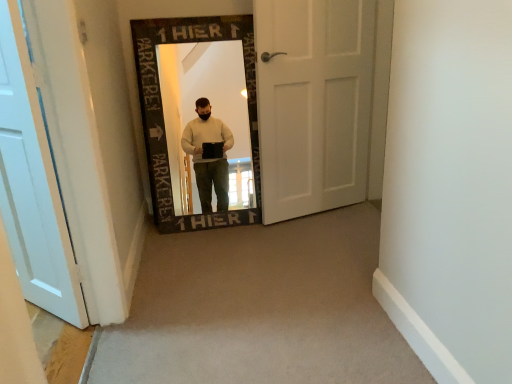
Question: Would you say white painted wood door at left, which is the first door from left to right, is to the left or to the right of white matte door at center, the 1th door in the back-to-front sequence, in the picture?

Choices:
 (A) right
 (B) left

Answer: (B)

Question: Considering their positions, is white painted wood door at left, which is counted as the first door, starting from the front, located in front of or behind white matte door at center, the 1th door positioned from the right?

Choices:
 (A) front
 (B) behind

Answer: (A)

Question: Looking at their shapes, would you say white painted wood door at left, placed as the second door when sorted from back to front, is wider or thinner than white matte door at center, the 1th door in the back-to-front sequence?

Choices:
 (A) wide
 (B) thin

Answer: (A)

Question: Looking at their shapes, would you say white matte door at center, which is the 2th door from front to back, is wider or thinner than white painted wood door at left, which is the second door from right to left?

Choices:
 (A) wide
 (B) thin

Answer: (B)

Question: From their relative heights in the image, would you say white matte door at center, the 1th door positioned from the right, is taller or shorter than white painted wood door at left, which is the first door from left to right?

Choices:
 (A) short
 (B) tall

Answer: (B)

Question: From the image's perspective, relative to white painted wood door at left, which is counted as the first door, starting from the front, is white matte door at center, the 1th door positioned from the right, above or below?

Choices:
 (A) above
 (B) below

Answer: (A)

Question: Would you say white matte door at center, positioned as the second door in left-to-right order, is inside or outside white painted wood door at left, which is the first door from left to right?

Choices:
 (A) outside
 (B) inside

Answer: (A)